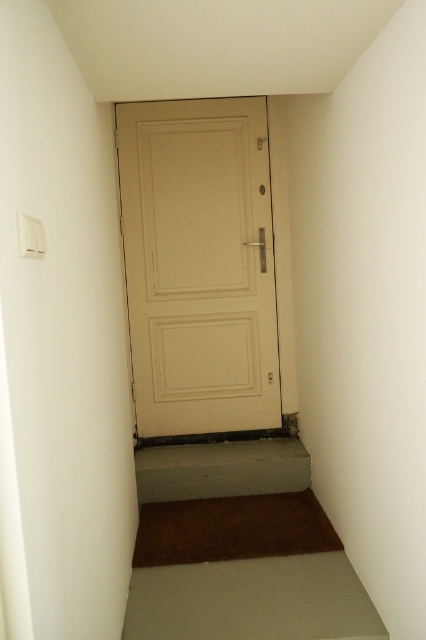
Question: Which of the following is the closest to the observer?

Choices:
 (A) beige matte door at center
 (B) brown carpet at lower center

Answer: (B)

Question: Is beige matte door at center further to camera compared to brown carpet at lower center?

Choices:
 (A) no
 (B) yes

Answer: (B)

Question: Does beige matte door at center appear over brown carpet at lower center?

Choices:
 (A) yes
 (B) no

Answer: (A)

Question: Can you confirm if beige matte door at center is positioned to the right of brown carpet at lower center?

Choices:
 (A) yes
 (B) no

Answer: (B)

Question: Which point appears closest to the camera in this image?

Choices:
 (A) click(118, 132)
 (B) click(250, 515)

Answer: (B)